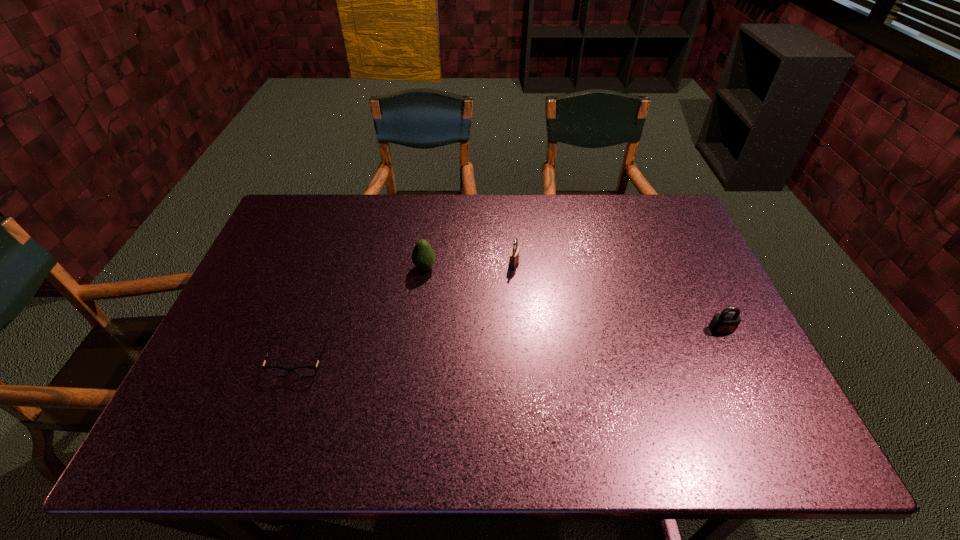
Find the location of a particular element. The height and width of the screenshot is (540, 960). free space located on the front-facing side of the leftmost object is located at coordinates (271, 443).

Locate an element on the screen. Image resolution: width=960 pixels, height=540 pixels. object located at the left edge is located at coordinates (305, 371).

Where is `object that is at the right edge`? object that is at the right edge is located at coordinates (723, 323).

Locate an element on the screen. This screenshot has height=540, width=960. vacant space at the far edge is located at coordinates (439, 226).

In the image, there is a desktop. Find the location of `vacant space at the near edge`. vacant space at the near edge is located at coordinates (657, 446).

At what (x,y) coordinates should I click in order to perform the action: click on vacant space at the left edge of the desktop. Please return your answer as a coordinate pair (x, y). The image size is (960, 540). Looking at the image, I should click on (276, 265).

In the image, there is a desktop. Find the location of `vacant space at the right edge`. vacant space at the right edge is located at coordinates (736, 369).

The image size is (960, 540). Find the location of `vacant space at the far right corner of the desktop`. vacant space at the far right corner of the desktop is located at coordinates click(x=664, y=222).

This screenshot has width=960, height=540. Find the location of `free space that is in between the shortest object and the third object from left to right`. free space that is in between the shortest object and the third object from left to right is located at coordinates (407, 312).

The width and height of the screenshot is (960, 540). Find the location of `empty space that is in between the third farthest object and the spectacles`. empty space that is in between the third farthest object and the spectacles is located at coordinates (511, 344).